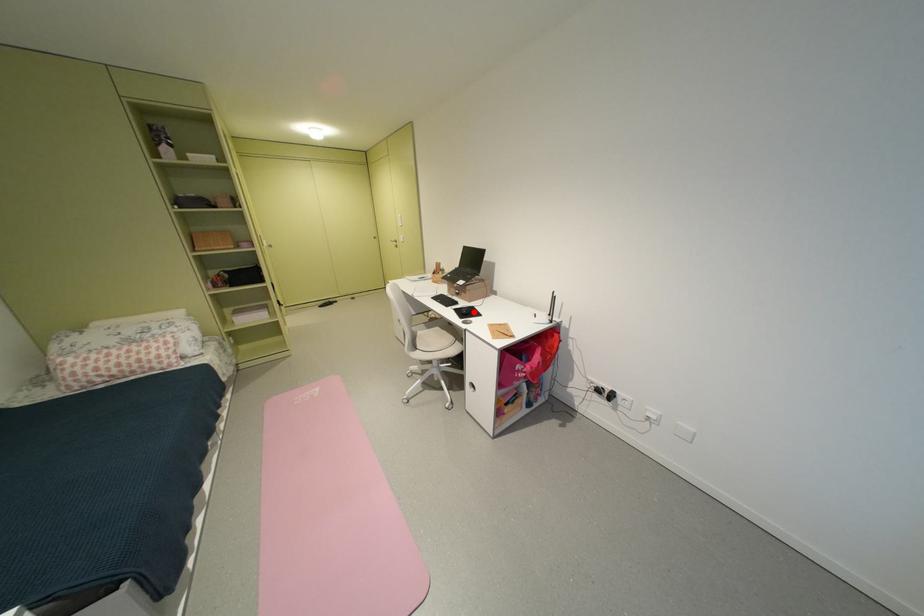
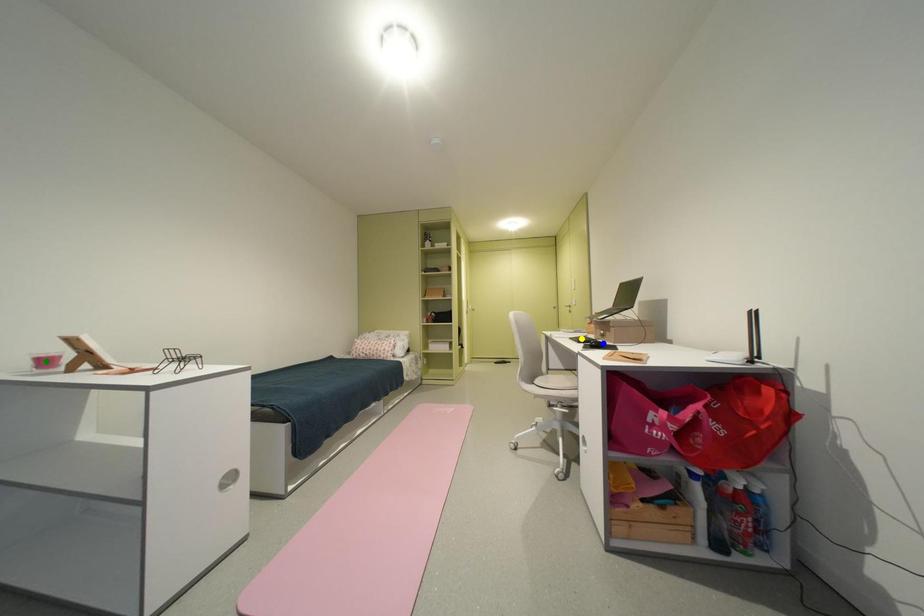
Question: I am providing you with two images of the same scene from different viewpoints. A red point is marked on the first image. You are given multiple points on the second image. Which point in image 2 is actually the same real-world point as the red point in image 1?

Choices:
 (A) green point
 (B) blue point
 (C) yellow point

Answer: (B)